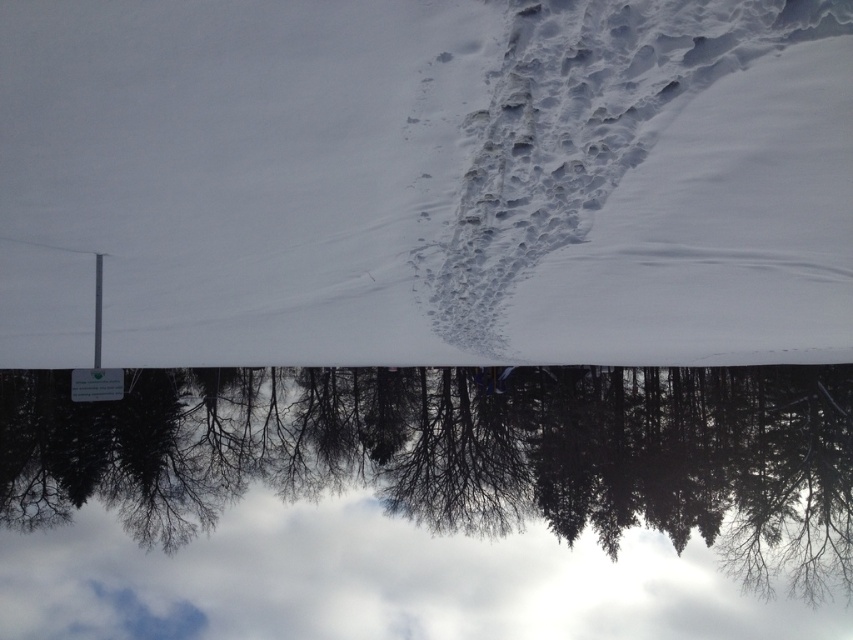
You are an animal tracker in the snowy landscape. You notice the white powdery snow at center and the silvery metallic trees at center. Which one is higher in the image?

The white powdery snow at center is above the silvery metallic trees at center, so the white powdery snow at center is higher in the image.

You are standing at the bottom left corner of the snowy landscape and want to walk towards the white powdery snow at center. In which direction should you head?

The white powdery snow at center is located at coordinates (425, 180). Since you are at the bottom left corner, you should head diagonally towards the upper right direction to reach it.